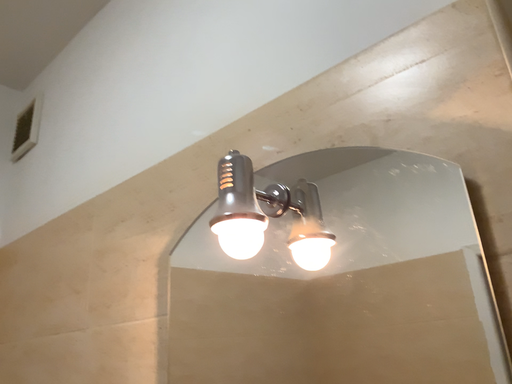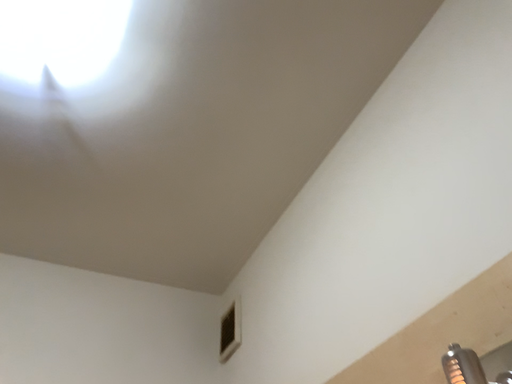
Question: How did the camera likely rotate when shooting the video?

Choices:
 (A) rotated upward
 (B) rotated downward

Answer: (A)